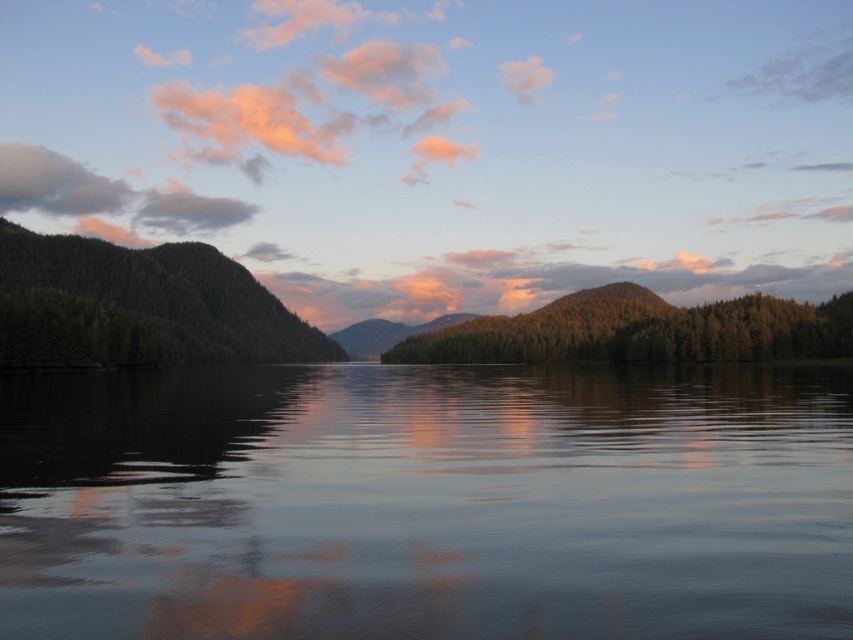
Question: Can you confirm if smooth reflective water at center is positioned to the right of green textured forest at center?

Choices:
 (A) yes
 (B) no

Answer: (B)

Question: Based on their relative distances, which object is nearer to the smooth reflective water at center?

Choices:
 (A) green textured forest at center
 (B) green matte forest at left

Answer: (B)

Question: Which point appears farthest from the camera in this image?

Choices:
 (A) (762, 317)
 (B) (38, 545)

Answer: (A)

Question: Which object is positioned farthest from the smooth reflective water at center?

Choices:
 (A) green textured forest at center
 (B) green matte forest at left

Answer: (A)

Question: Is smooth reflective water at center above green textured forest at center?

Choices:
 (A) no
 (B) yes

Answer: (A)

Question: Is the position of smooth reflective water at center less distant than that of green textured forest at center?

Choices:
 (A) no
 (B) yes

Answer: (B)